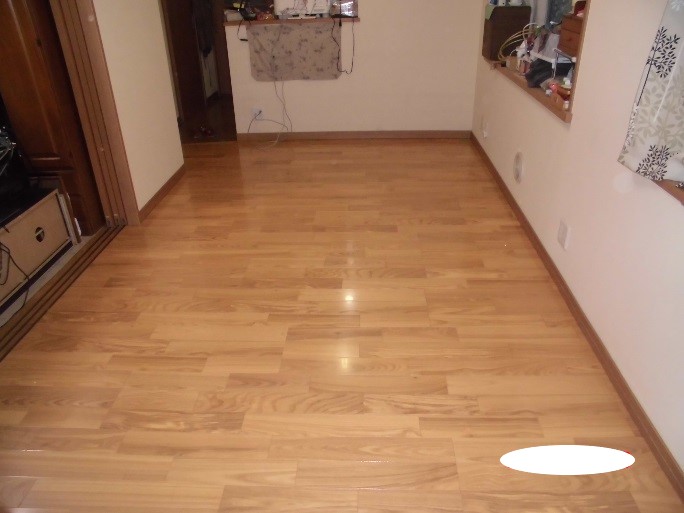
Locate an element on the screen. newspaper is located at coordinates (624, 149).